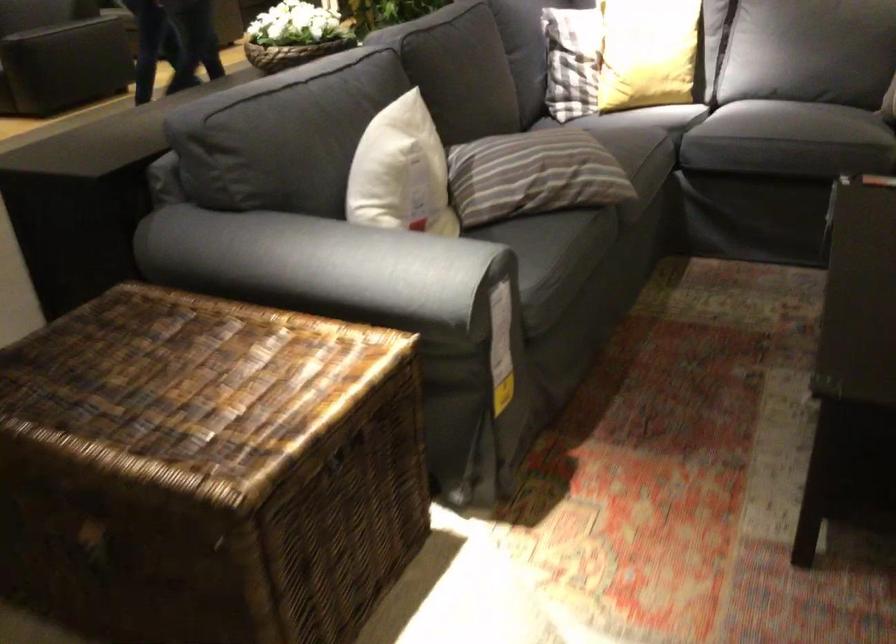
Where is `grey sofa armrest`? grey sofa armrest is located at coordinates (304, 265).